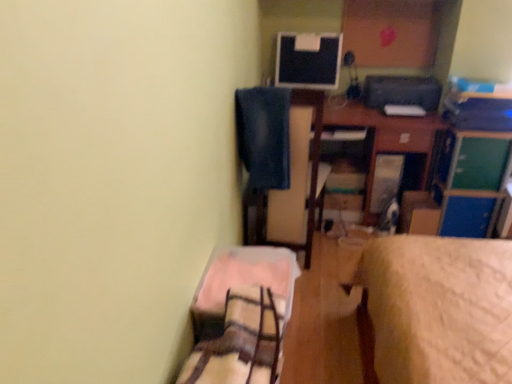
Locate an element on the screen. free spot above cardboard box at center (from a real-world perspective) is located at coordinates 425,195.